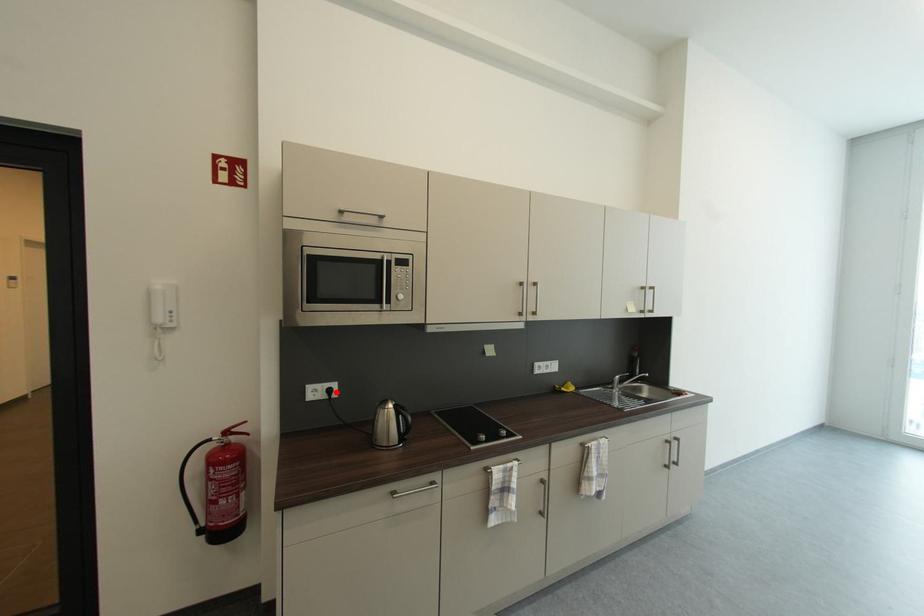
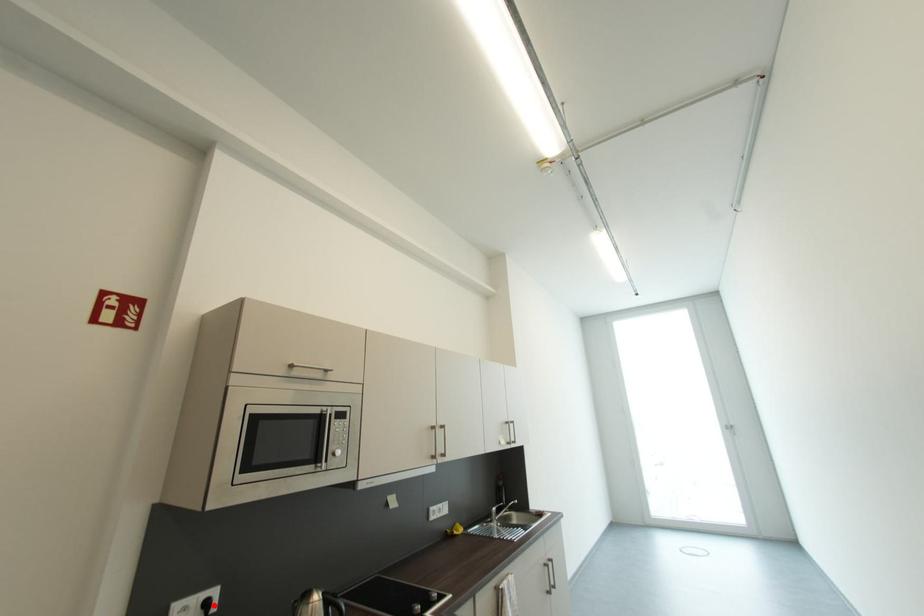
I am providing you with two images of the same scene from different viewpoints. A red point is marked on the first image and another point is marked on the second image. Does the point marked in image1 correspond to the same location as the one in image2?

Yes